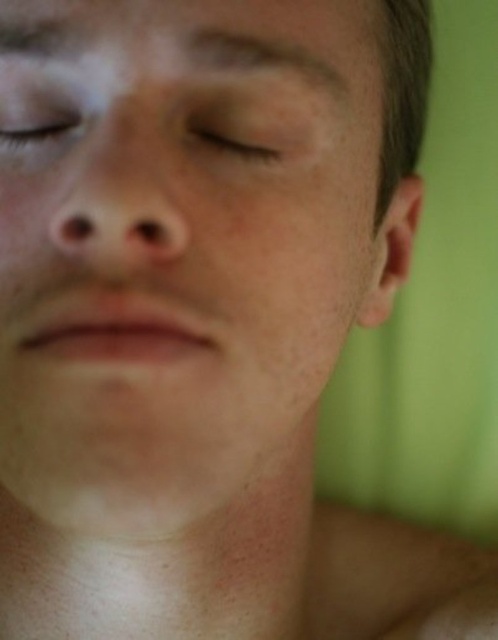
You are a photographer adjusting the focus on a camera. The subject has a smooth skin face at center. Where should you position the focus point to ensure the face is in sharp focus?

The smooth skin face at center is positioned at point (178, 248), so you should position the focus point at those coordinates to ensure sharp focus.

You are a dermatologist examining a patient. You notice two areas on their face at the center. The first is labeled as smooth skin face at center, and the second is matte skin at center. Which area is positioned to the left?

The smooth skin face at center is positioned to the left of the matte skin at center according to the description.